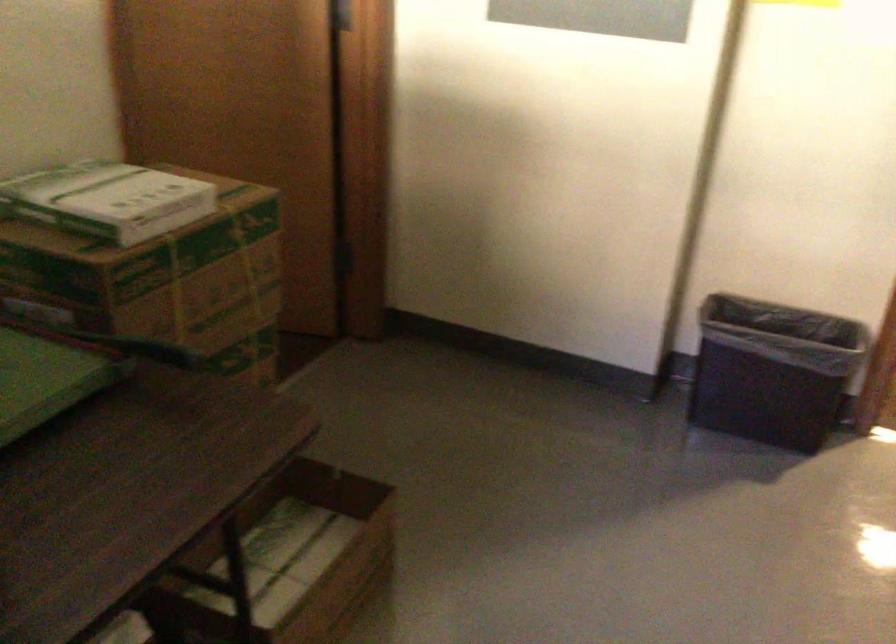
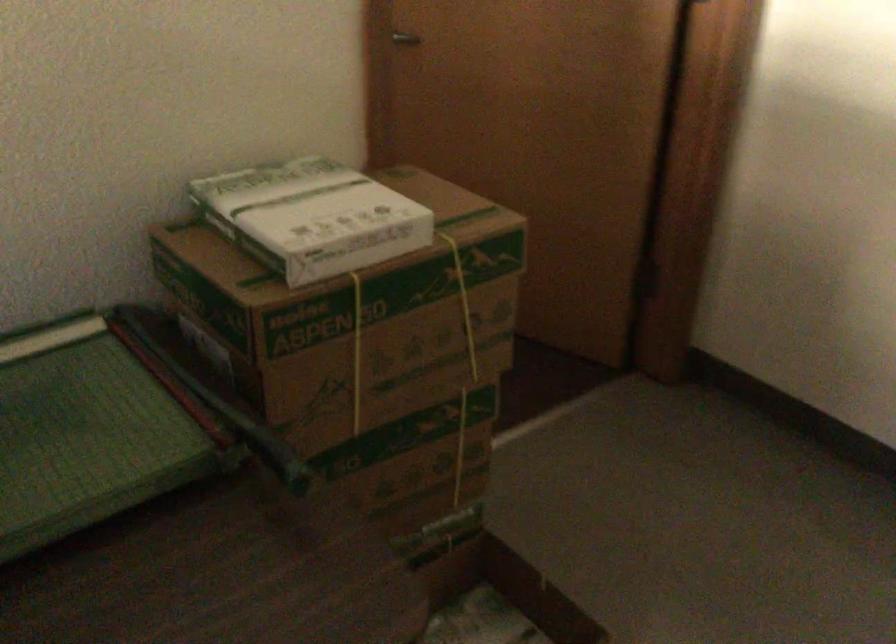
Question: Which direction would the cameraman need to move to produce the second image? Reply with the corresponding letter.

Choices:
 (A) Left
 (B) Right
 (C) Forward
 (D) Backward

Answer: (C)